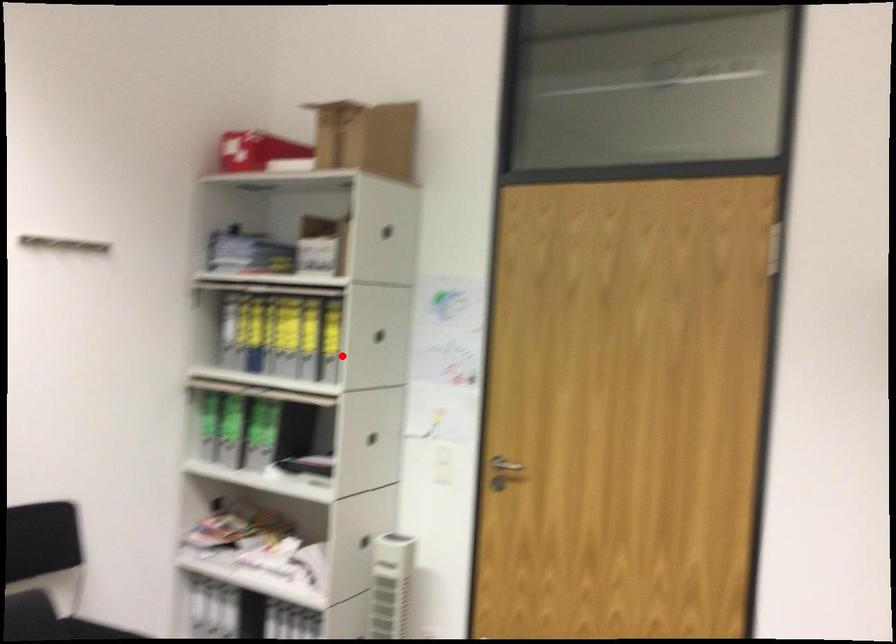
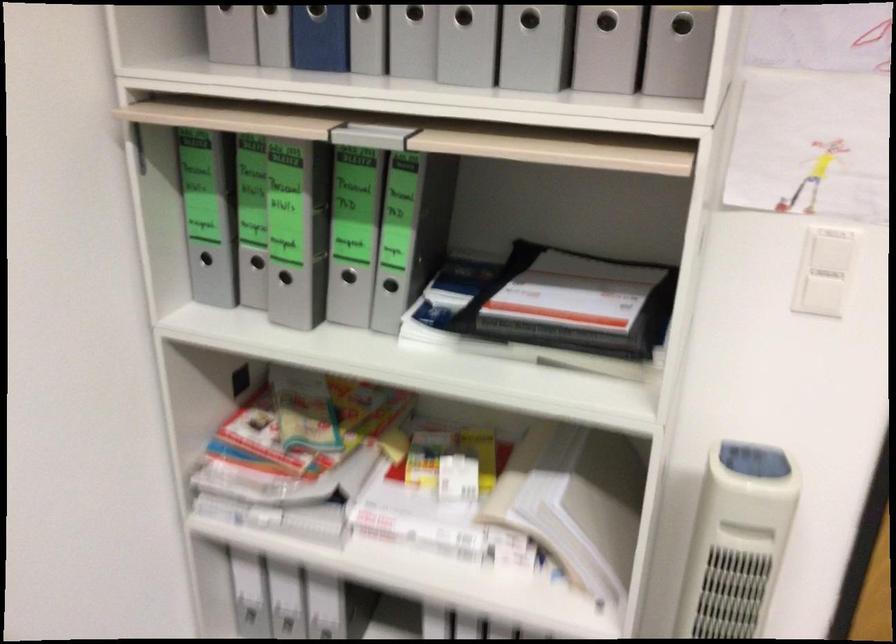
Where in the second image is the point corresponding to the highlighted location from the first image?

(606, 21)